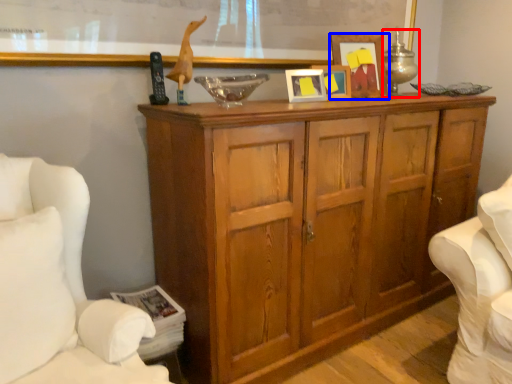
Question: Which point is closer to the camera, table lamp (highlighted by a red box) or picture frame (highlighted by a blue box)?

Choices:
 (A) table lamp
 (B) picture frame

Answer: (B)